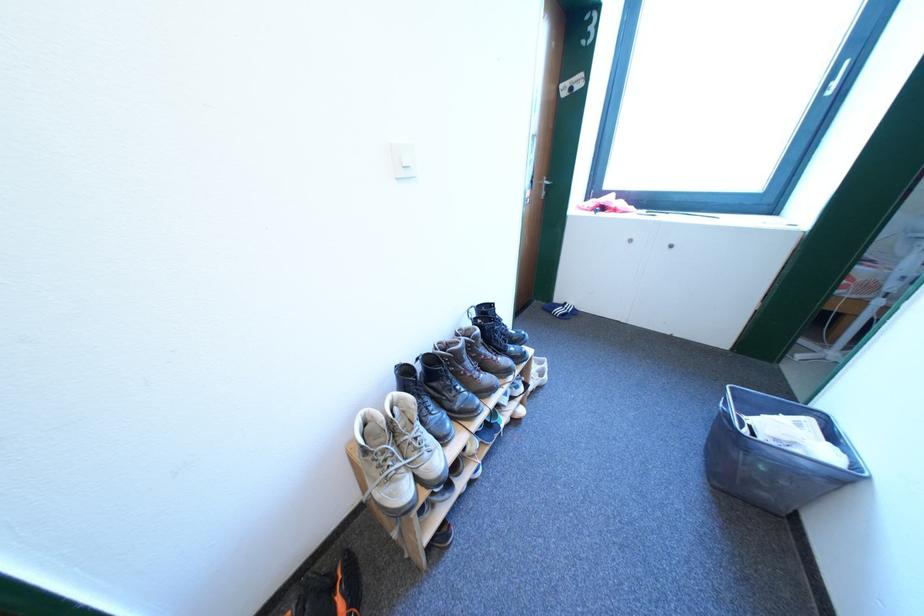
The image size is (924, 616). In order to click on white light switch in this screenshot , I will do `click(403, 160)`.